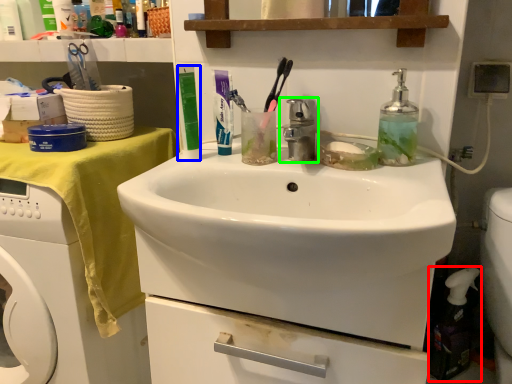
Question: Which object is the farthest from cleaning product (highlighted by a red box)? Choose among these: toiletry (highlighted by a blue box) or tap (highlighted by a green box).

Choices:
 (A) toiletry
 (B) tap

Answer: (A)